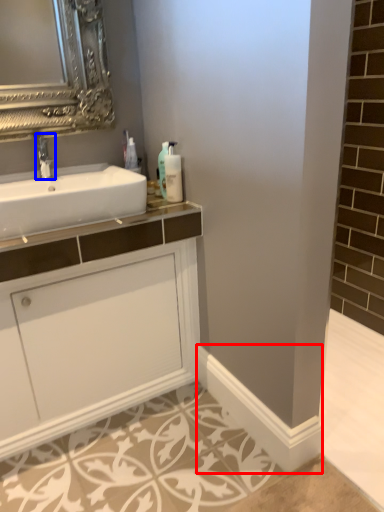
Question: Which object is further to the camera taking this photo, molding (highlighted by a red box) or tap (highlighted by a blue box)?

Choices:
 (A) molding
 (B) tap

Answer: (B)